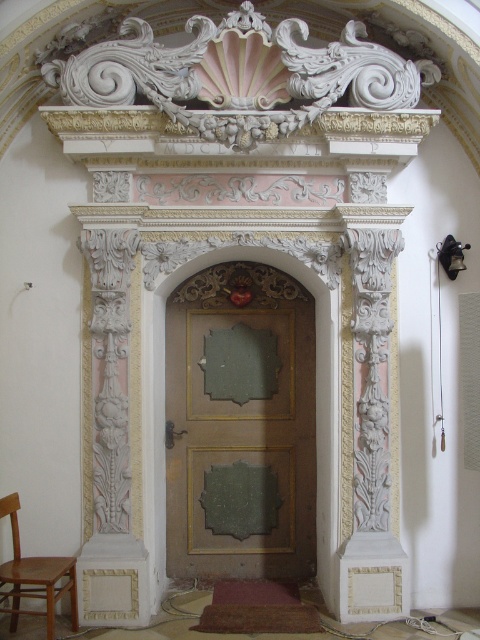
Which is more to the right, green wood door at center or wooden chair at lower left?

Positioned to the right is green wood door at center.

Who is more forward, (191, 500) or (49, 568)?

Positioned in front is point (49, 568).

I want to click on green wood door at center, so click(x=230, y=321).

You are a GUI agent. You are given a task and a screenshot of the screen. Output one action in this format:
    pyautogui.click(x=<x>, y=<y>)
    Task: Click on the green wood door at center
    This screenshot has width=480, height=640.
    Given the screenshot: What is the action you would take?
    pyautogui.click(x=230, y=321)